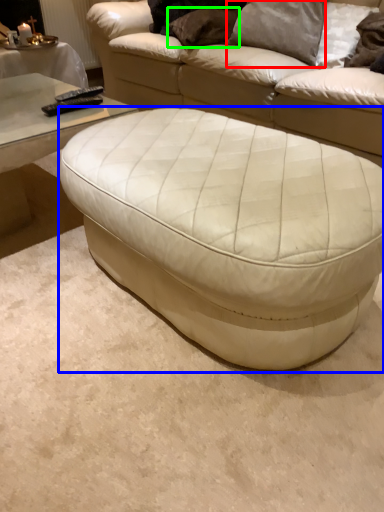
Question: Estimate the real-world distances between objects in this image. Which object is closer to pillow (highlighted by a red box), table (highlighted by a blue box) or pillow (highlighted by a green box)?

Choices:
 (A) table
 (B) pillow

Answer: (B)